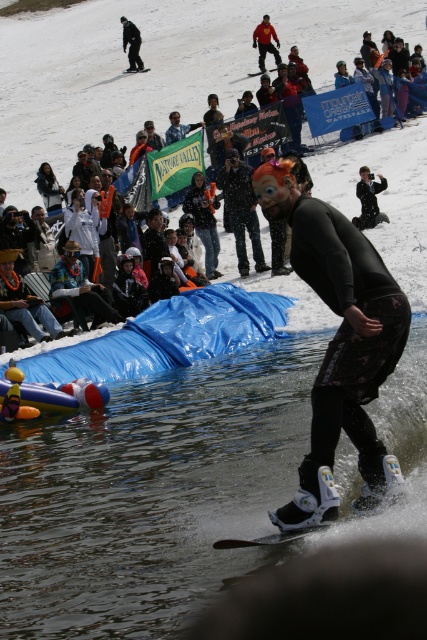
You are a photographer at the water skiing event and want to capture a photo that includes both the black matte jacket at center and the orange fabric mask at center. Based on their positions, which object should you focus on first to ensure both are in the frame?

The black matte jacket at center is located below the orange fabric mask at center, so you should focus on the orange fabric mask at center first to ensure both are in the frame.

You are standing at the edge of the snowy slope where the water skiing event is taking place. There is a point marked at coordinates [246,168] in the scene. If you want to throw a rope to reach that point from where you are standing, will the distance be more than 30 meters?

The point at coordinates [246,168] is 31.29 meters away from the viewer. Since 31.29 meters is more than 30 meters, the distance is indeed greater than 30 meters. Therefore, the rope would need to be at least 31.29 meters long to reach that point.